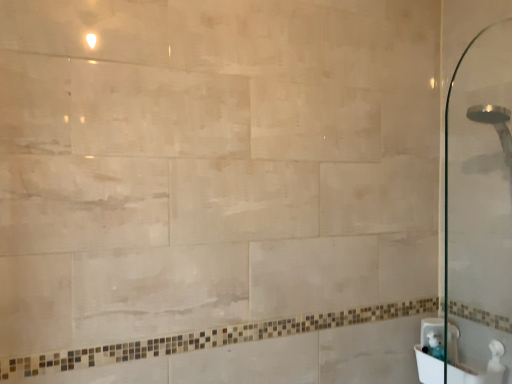
The width and height of the screenshot is (512, 384). What do you see at coordinates (473, 362) in the screenshot?
I see `white glossy sink at lower right, the 1th sink viewed from the front` at bounding box center [473, 362].

Find the location of a particular element. The image size is (512, 384). white glossy sink at lower right, positioned as the 2th sink in back-to-front order is located at coordinates 473,362.

Image resolution: width=512 pixels, height=384 pixels. Find the location of `white glossy sink at lower right, which is the second sink from front to back`. white glossy sink at lower right, which is the second sink from front to back is located at coordinates (431, 332).

How much space does white glossy sink at lower right, placed as the first sink when sorted from back to front, occupy vertically?

white glossy sink at lower right, placed as the first sink when sorted from back to front, is 8.13 inches in height.

What do you see at coordinates (431, 332) in the screenshot? I see `white glossy sink at lower right, placed as the first sink when sorted from back to front` at bounding box center [431, 332].

In order to click on white glossy sink at lower right, the 1th sink viewed from the front in this screenshot , I will do `click(473, 362)`.

In the image, is white glossy sink at lower right, which is the second sink from front to back, on the left side or the right side of white glossy sink at lower right, positioned as the 2th sink in back-to-front order?

white glossy sink at lower right, which is the second sink from front to back, is positioned on white glossy sink at lower right, positioned as the 2th sink in back-to-front order,'s left side.

Does white glossy sink at lower right, placed as the first sink when sorted from back to front, come behind white glossy sink at lower right, the 1th sink viewed from the front?

That is True.

Between point (428, 338) and point (456, 349), which one is positioned behind?

The point (456, 349) is farther from the camera.

From the image's perspective, is white glossy sink at lower right, which is the second sink from front to back, positioned above or below white glossy sink at lower right, positioned as the 2th sink in back-to-front order?

From the image's perspective, white glossy sink at lower right, which is the second sink from front to back, appears above white glossy sink at lower right, positioned as the 2th sink in back-to-front order.

From a real-world perspective, who is located higher, white glossy sink at lower right, which is the second sink from front to back, or white glossy sink at lower right, the 1th sink viewed from the front?

white glossy sink at lower right, which is the second sink from front to back, from a real-world perspective.

From the picture: Considering the sizes of objects white glossy sink at lower right, which is the second sink from front to back, and white glossy sink at lower right, the 1th sink viewed from the front, in the image provided, who is wider, white glossy sink at lower right, which is the second sink from front to back, or white glossy sink at lower right, the 1th sink viewed from the front,?

Wider between the two is white glossy sink at lower right, the 1th sink viewed from the front.

In the scene shown: Is white glossy sink at lower right, placed as the first sink when sorted from back to front, taller than white glossy sink at lower right, positioned as the 2th sink in back-to-front order?

Indeed, white glossy sink at lower right, placed as the first sink when sorted from back to front, has a greater height compared to white glossy sink at lower right, positioned as the 2th sink in back-to-front order.

Is white glossy sink at lower right, which is the second sink from front to back, smaller than white glossy sink at lower right, positioned as the 2th sink in back-to-front order?

Yes, white glossy sink at lower right, which is the second sink from front to back, is smaller than white glossy sink at lower right, positioned as the 2th sink in back-to-front order.

Do you think white glossy sink at lower right, which is the second sink from front to back, is within white glossy sink at lower right, the 1th sink viewed from the front, or outside of it?

white glossy sink at lower right, which is the second sink from front to back, is enclosed within white glossy sink at lower right, the 1th sink viewed from the front.

Consider the image. Is white glossy sink at lower right, which is the second sink from front to back, next to white glossy sink at lower right, positioned as the 2th sink in back-to-front order?

Yes, white glossy sink at lower right, which is the second sink from front to back, is touching white glossy sink at lower right, positioned as the 2th sink in back-to-front order.

Is white glossy sink at lower right, which is the second sink from front to back, oriented towards white glossy sink at lower right, the 1th sink viewed from the front?

Yes.

How different are the orientations of white glossy sink at lower right, placed as the first sink when sorted from back to front, and white glossy sink at lower right, positioned as the 2th sink in back-to-front order, in degrees?

The angle between the facing direction of white glossy sink at lower right, placed as the first sink when sorted from back to front, and the facing direction of white glossy sink at lower right, positioned as the 2th sink in back-to-front order, is 0.996 degrees.

At what (x,y) coordinates should I click in order to perform the action: click on sink below the white glossy sink at lower right, which is the second sink from front to back (from the image's perspective). Please return your answer as a coordinate pair (x, y). The width and height of the screenshot is (512, 384). Looking at the image, I should click on (473, 362).

Is white glossy sink at lower right, the 1th sink viewed from the front, to the right of white glossy sink at lower right, placed as the first sink when sorted from back to front, from the viewer's perspective?

Indeed, white glossy sink at lower right, the 1th sink viewed from the front, is positioned on the right side of white glossy sink at lower right, placed as the first sink when sorted from back to front.

Is white glossy sink at lower right, the 1th sink viewed from the front, further to the viewer compared to white glossy sink at lower right, placed as the first sink when sorted from back to front?

No, white glossy sink at lower right, the 1th sink viewed from the front, is closer to the viewer.

Which point is more distant from viewer, (457, 374) or (426, 332)?

Positioned behind is point (426, 332).

Looking at this image, from the image's perspective, between white glossy sink at lower right, positioned as the 2th sink in back-to-front order, and white glossy sink at lower right, placed as the first sink when sorted from back to front, who is located below?

white glossy sink at lower right, positioned as the 2th sink in back-to-front order, from the image's perspective.

From a real-world perspective, relative to white glossy sink at lower right, which is the second sink from front to back, is white glossy sink at lower right, positioned as the 2th sink in back-to-front order, vertically above or below?

In terms of real-world spatial position, white glossy sink at lower right, positioned as the 2th sink in back-to-front order, is below white glossy sink at lower right, which is the second sink from front to back.

Which object is thinner, white glossy sink at lower right, positioned as the 2th sink in back-to-front order, or white glossy sink at lower right, placed as the first sink when sorted from back to front?

With smaller width is white glossy sink at lower right, placed as the first sink when sorted from back to front.

Considering the relative sizes of white glossy sink at lower right, positioned as the 2th sink in back-to-front order, and white glossy sink at lower right, which is the second sink from front to back, in the image provided, is white glossy sink at lower right, positioned as the 2th sink in back-to-front order, taller than white glossy sink at lower right, which is the second sink from front to back,?

Incorrect, the height of white glossy sink at lower right, positioned as the 2th sink in back-to-front order, is not larger of that of white glossy sink at lower right, which is the second sink from front to back.

Is white glossy sink at lower right, positioned as the 2th sink in back-to-front order, bigger than white glossy sink at lower right, placed as the first sink when sorted from back to front?

Yes.

Is white glossy sink at lower right, positioned as the 2th sink in back-to-front order, inside the boundaries of white glossy sink at lower right, which is the second sink from front to back, or outside?

white glossy sink at lower right, positioned as the 2th sink in back-to-front order, is outside white glossy sink at lower right, which is the second sink from front to back.

Is white glossy sink at lower right, positioned as the 2th sink in back-to-front order, touching white glossy sink at lower right, placed as the first sink when sorted from back to front?

Yes, white glossy sink at lower right, positioned as the 2th sink in back-to-front order, is next to white glossy sink at lower right, placed as the first sink when sorted from back to front.

Is white glossy sink at lower right, positioned as the 2th sink in back-to-front order, facing towards white glossy sink at lower right, placed as the first sink when sorted from back to front?

Yes.

What's the angular difference between white glossy sink at lower right, the 1th sink viewed from the front, and white glossy sink at lower right, which is the second sink from front to back,'s facing directions?

0.996 degrees.

How far apart are white glossy sink at lower right, the 1th sink viewed from the front, and white glossy sink at lower right, placed as the first sink when sorted from back to front?

The distance of white glossy sink at lower right, the 1th sink viewed from the front, from white glossy sink at lower right, placed as the first sink when sorted from back to front, is 2.32 inches.

I want to click on sink that appears on the right of white glossy sink at lower right, placed as the first sink when sorted from back to front, so click(x=473, y=362).

Find the location of a particular element. sink beneath the white glossy sink at lower right, which is the second sink from front to back (from a real-world perspective) is located at coordinates (473, 362).

The height and width of the screenshot is (384, 512). I want to click on sink lying on the right of white glossy sink at lower right, which is the second sink from front to back, so click(473, 362).